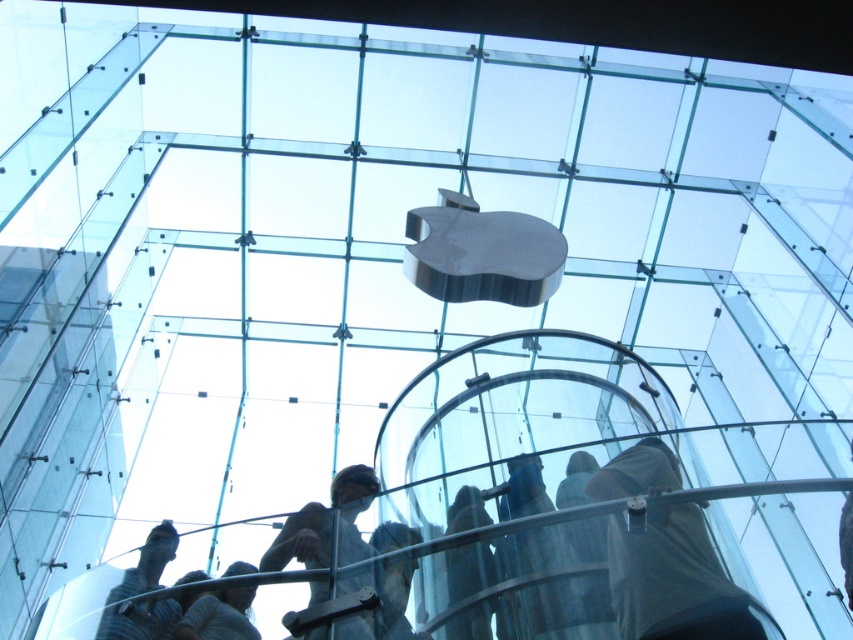
You are a photographer standing in front of the Apple store. You notice two people wearing shirts with different patterns. The person wearing the striped fabric shirt at lower left and the person in the gray fabric shirt at lower center. Which shirt appears narrower?

The striped fabric shirt at lower left appears narrower as it has a lesser width compared to the gray fabric shirt at lower center.

You are a visitor at the Apple store and want to take a photo of the metallic statue at center and the striped fabric shirt at lower left. Which object should you focus on if you want the larger one to be in clear focus?

You should focus on the metallic statue at center because it is larger in size than the striped fabric shirt at lower left.